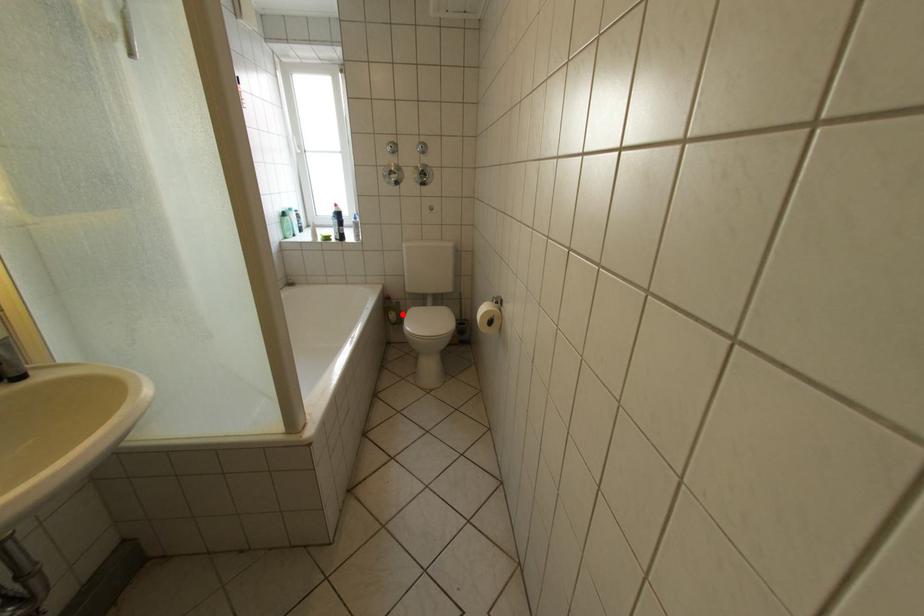
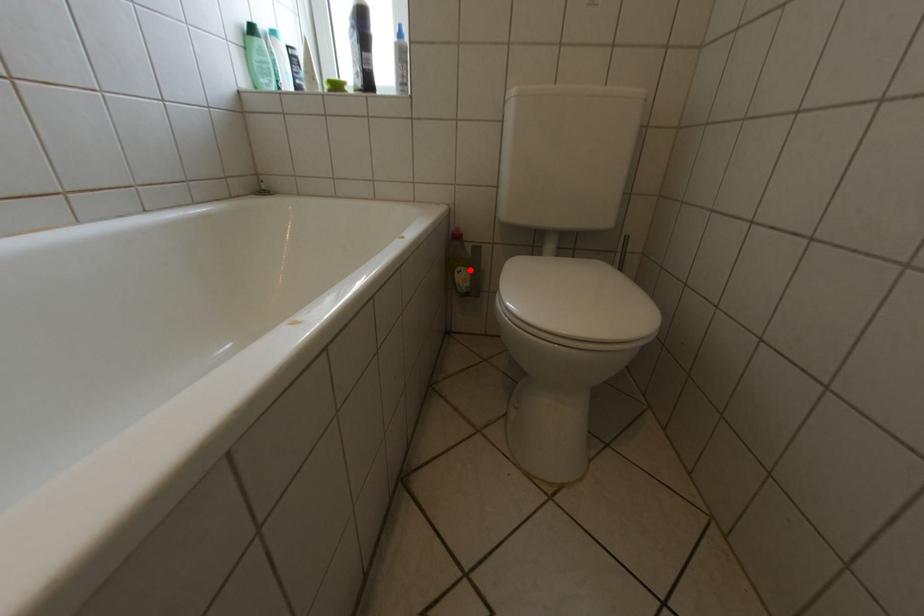
I am providing you with two images of the same scene from different viewpoints. A red point is marked on the first image and another point is marked on the second image. Does the point marked in image1 correspond to the same location as the one in image2?

Yes